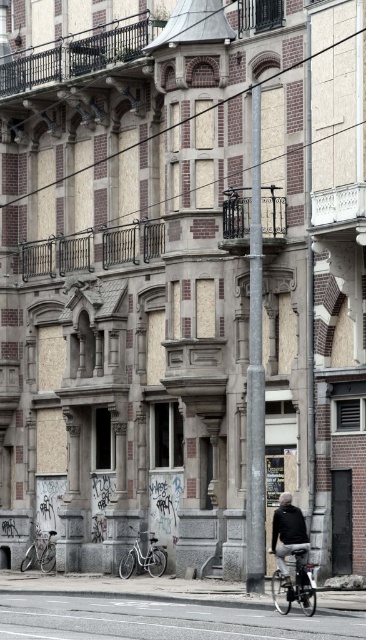
Question: Based on their relative distances, which object is farther from the shiny metallic bicycle at center?

Choices:
 (A) dark gray jacket at center
 (B) white matte bicycle at lower center

Answer: (B)

Question: Is shiny metallic bicycle at center below dark gray jacket at center?

Choices:
 (A) no
 (B) yes

Answer: (B)

Question: Which of the following is the closest to the observer?

Choices:
 (A) shiny metallic bicycle at center
 (B) dark gray jacket at center

Answer: (A)

Question: Is dark gray jacket at center to the right of silver metallic bicycle at lower left from the viewer's perspective?

Choices:
 (A) yes
 (B) no

Answer: (A)

Question: Is dark gray jacket at center closer to the viewer compared to silver metallic bicycle at lower left?

Choices:
 (A) no
 (B) yes

Answer: (B)

Question: Which point appears farthest from the camera in this image?

Choices:
 (A) (274, 577)
 (B) (27, 563)
 (C) (147, 552)

Answer: (B)